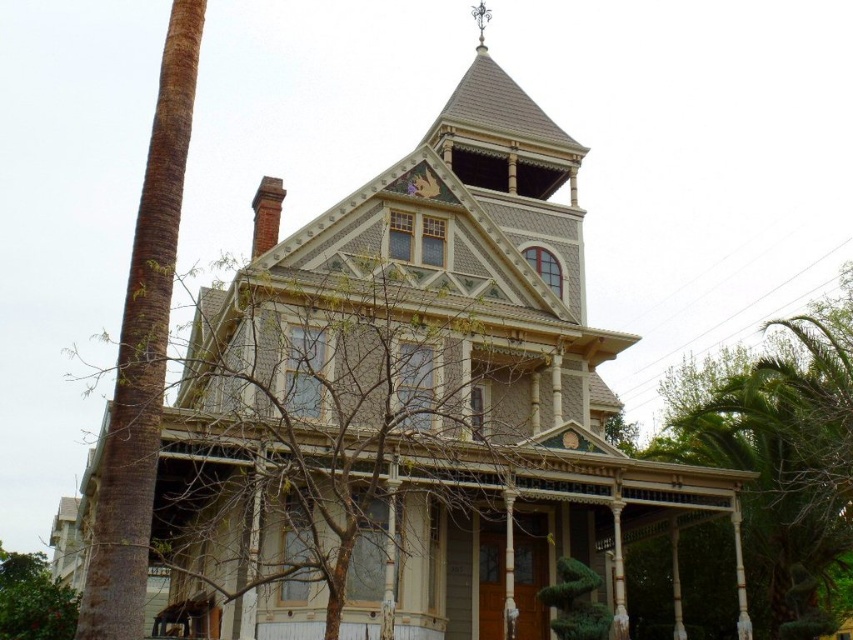
You are standing in front of the Victorian house and notice two trees. One is the bare branches at upper center and the other is the green leafy tree at lower right. Which tree appears narrower when viewed from your position?

The bare branches at upper center appears narrower because it has a lesser width compared to the green leafy tree at lower right.